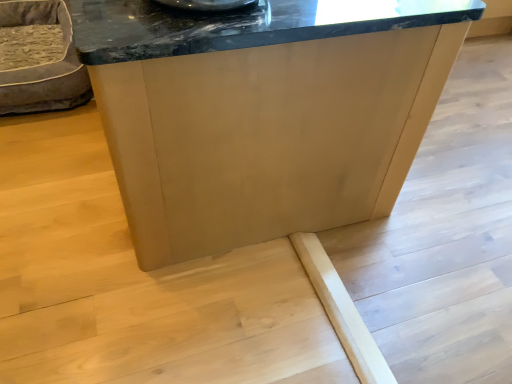
Question: Is velvet grey pet bed at left located outside matte wood table at center?

Choices:
 (A) yes
 (B) no

Answer: (A)

Question: Is velvet grey pet bed at left bigger than matte wood table at center?

Choices:
 (A) yes
 (B) no

Answer: (B)

Question: Does velvet grey pet bed at left come in front of matte wood table at center?

Choices:
 (A) no
 (B) yes

Answer: (A)

Question: Can you confirm if velvet grey pet bed at left is smaller than matte wood table at center?

Choices:
 (A) yes
 (B) no

Answer: (A)

Question: Can you confirm if velvet grey pet bed at left is positioned to the right of matte wood table at center?

Choices:
 (A) yes
 (B) no

Answer: (B)

Question: Is velvet grey pet bed at left facing away from matte wood table at center?

Choices:
 (A) yes
 (B) no

Answer: (B)

Question: From the image's perspective, is matte wood table at center over velvet grey pet bed at left?

Choices:
 (A) no
 (B) yes

Answer: (A)

Question: Could you tell me if matte wood table at center is facing velvet grey pet bed at left?

Choices:
 (A) yes
 (B) no

Answer: (B)

Question: Would you consider matte wood table at center to be distant from velvet grey pet bed at left?

Choices:
 (A) yes
 (B) no

Answer: (A)

Question: Can you confirm if matte wood table at center is positioned to the left of velvet grey pet bed at left?

Choices:
 (A) yes
 (B) no

Answer: (B)

Question: Is matte wood table at center positioned beyond the bounds of velvet grey pet bed at left?

Choices:
 (A) no
 (B) yes

Answer: (B)

Question: Is matte wood table at center thinner than velvet grey pet bed at left?

Choices:
 (A) yes
 (B) no

Answer: (B)

Question: Relative to velvet grey pet bed at left, is matte wood table at center in front or behind?

Choices:
 (A) behind
 (B) front

Answer: (B)